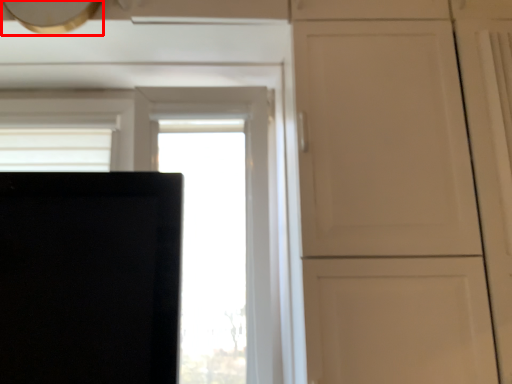
Question: From the image, what is the correct spatial relationship of exhaust hood (annotated by the red box) in relation to window?

Choices:
 (A) right
 (B) left

Answer: (B)